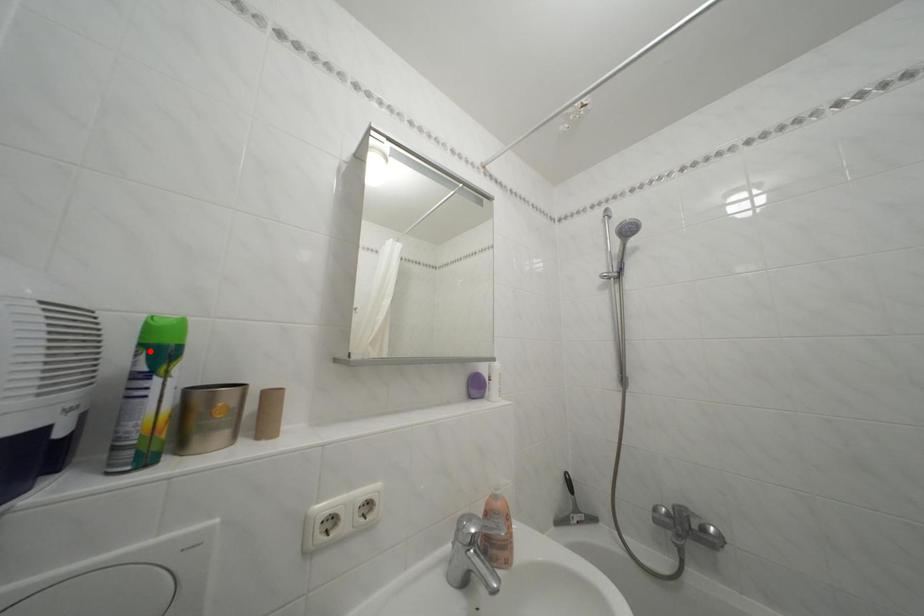
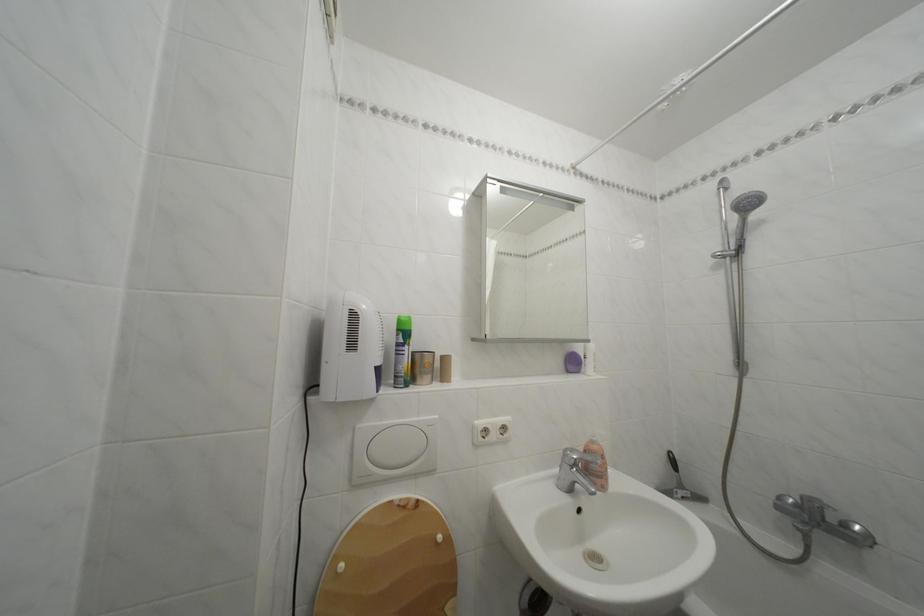
In the second image, find the point that corresponds to the highlighted location in the first image.

(407, 336)